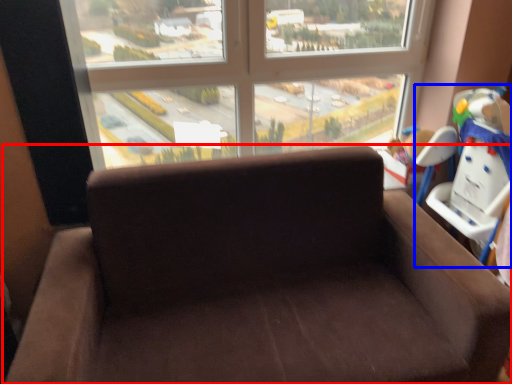
Question: Which of the following is the farthest to the observer, studio couch (highlighted by a red box) or baby carriage (highlighted by a blue box)?

Choices:
 (A) studio couch
 (B) baby carriage

Answer: (B)